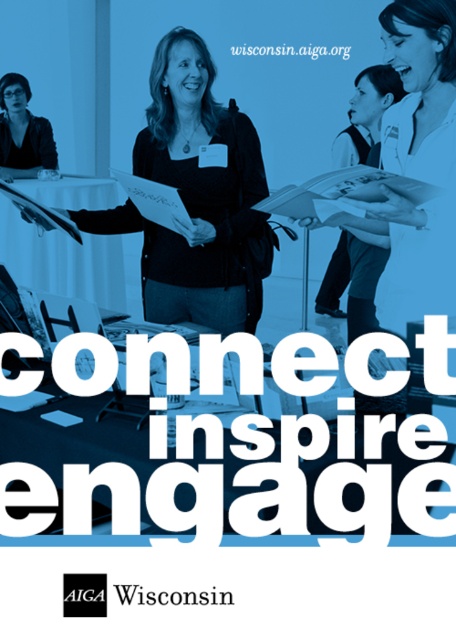
Question: Among these objects, which one is farthest from the camera?

Choices:
 (A) matte black jacket at upper left
 (B) matte black sweater at center

Answer: (A)

Question: From the image, what is the correct spatial relationship of matte black sweater at center in relation to matte black jacket at upper left?

Choices:
 (A) left
 (B) right

Answer: (B)

Question: Which of the following is the closest to the observer?

Choices:
 (A) coord(330,49)
 (B) coord(154,96)
 (C) coord(191,593)

Answer: (C)

Question: Which object is positioned closest to the blacktexturedwisconsin at center?

Choices:
 (A) matte black sweater at center
 (B) matte black jacket at upper left
 (C) white paper at upper center

Answer: (A)

Question: Can you confirm if matte black sweater at center is smaller than white paper at upper center?

Choices:
 (A) no
 (B) yes

Answer: (A)

Question: Does matte black sweater at center have a larger size compared to white paper at upper center?

Choices:
 (A) yes
 (B) no

Answer: (A)